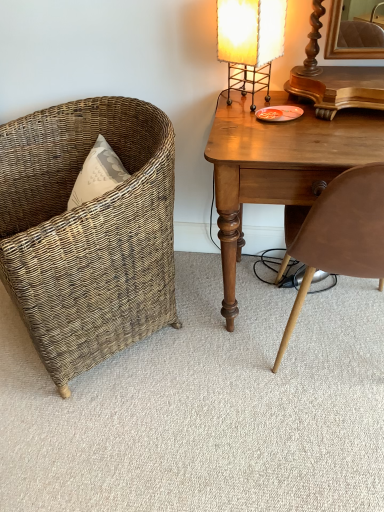
Question: Is wooden desk at right closer to the viewer compared to matte yellow fabric lampshade at upper right?

Choices:
 (A) no
 (B) yes

Answer: (B)

Question: Is wooden desk at right with matte yellow fabric lampshade at upper right?

Choices:
 (A) no
 (B) yes

Answer: (A)

Question: Does wooden desk at right have a greater width compared to matte yellow fabric lampshade at upper right?

Choices:
 (A) no
 (B) yes

Answer: (B)

Question: Is wooden desk at right surrounding matte yellow fabric lampshade at upper right?

Choices:
 (A) no
 (B) yes

Answer: (A)

Question: From a real-world perspective, is wooden desk at right on matte yellow fabric lampshade at upper right?

Choices:
 (A) yes
 (B) no

Answer: (B)

Question: Is there a large distance between wooden desk at right and matte yellow fabric lampshade at upper right?

Choices:
 (A) no
 (B) yes

Answer: (A)

Question: Can you confirm if brown leather chair at right, the 2th chair in the left-to-right sequence, is smaller than wooden desk at right?

Choices:
 (A) yes
 (B) no

Answer: (A)

Question: Is brown leather chair at right, the 2th chair in the left-to-right sequence, further to camera compared to wooden desk at right?

Choices:
 (A) no
 (B) yes

Answer: (A)

Question: Is brown leather chair at right, the 2th chair in the left-to-right sequence, not within wooden desk at right?

Choices:
 (A) yes
 (B) no

Answer: (B)

Question: From a real-world perspective, is brown leather chair at right, the first chair when ordered from right to left, under wooden desk at right?

Choices:
 (A) yes
 (B) no

Answer: (B)

Question: Does brown leather chair at right, the first chair when ordered from right to left, contain wooden desk at right?

Choices:
 (A) yes
 (B) no

Answer: (A)

Question: From the image's perspective, would you say brown leather chair at right, the 2th chair in the left-to-right sequence, is shown under wooden desk at right?

Choices:
 (A) no
 (B) yes

Answer: (B)

Question: From the image's perspective, is woven brown chair at left, which is counted as the first chair, starting from the left, under brown leather chair at right, the 2th chair in the left-to-right sequence?

Choices:
 (A) no
 (B) yes

Answer: (A)